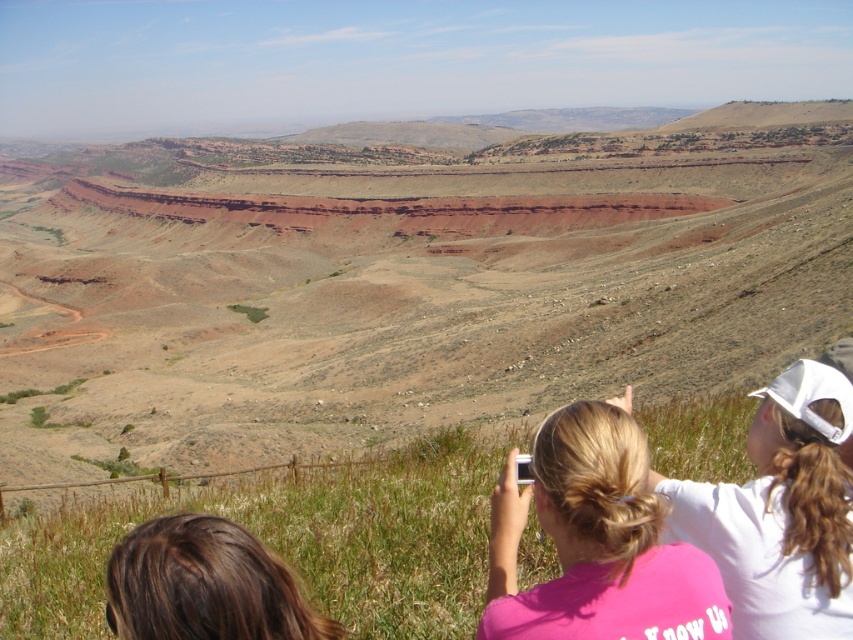
Question: Estimate the real-world distances between objects in this image. Which object is closer to the pink fabric shirt at lower right?

Choices:
 (A) pink fabric at center
 (B) brown hair at lower left

Answer: (A)

Question: Among these objects, which one is nearest to the camera?

Choices:
 (A) brown hair at lower left
 (B) pink fabric at center

Answer: (A)

Question: Which point is closer to the camera taking this photo?

Choices:
 (A) (186, 625)
 (B) (585, 426)
 (C) (836, 566)

Answer: (A)

Question: Can you confirm if pink fabric shirt at lower right is bigger than brown hair at lower left?

Choices:
 (A) yes
 (B) no

Answer: (A)

Question: Does pink fabric at center have a smaller size compared to pink fabric shirt at lower right?

Choices:
 (A) no
 (B) yes

Answer: (B)

Question: In this image, where is pink fabric at center located relative to brown hair at lower left?

Choices:
 (A) above
 (B) below

Answer: (A)